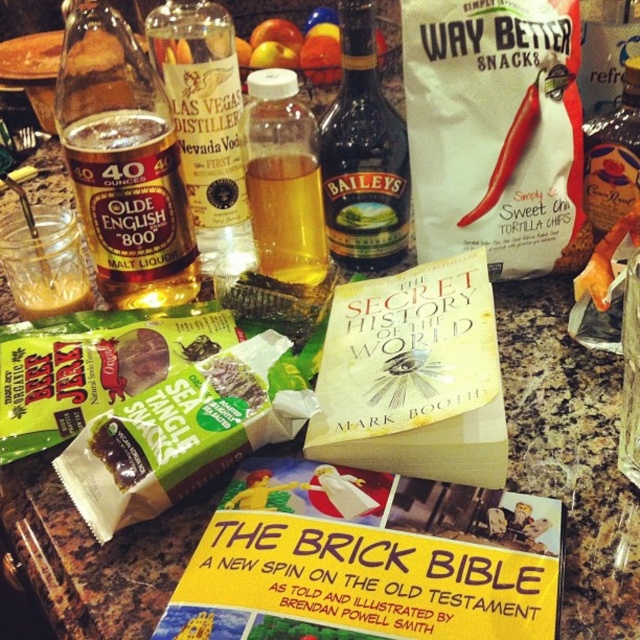
You are a bartender preparing a cocktail and need to reach for the dark brown glass bottle at center and the clear glass nevada vodka bottle at center. Which one is closer to you?

The clear glass nevada vodka bottle at center is closer to you because the dark brown glass bottle at center is behind it.

You are a delivery person who needs to place a new 20 inch box on the countertop. The translucent plastic bottle at center is in the way. Can you move the bottle to the side to make space?

The translucent plastic bottle at center is 19.12 inches from the camera, so it is close enough to move out of the way to make space for the 20 inch box.

Please provide the coordinates of the clear glass nevada vodka bottle at center in the image.

The clear glass nevada vodka bottle at center is located at coordinates point (x=205, y=124).